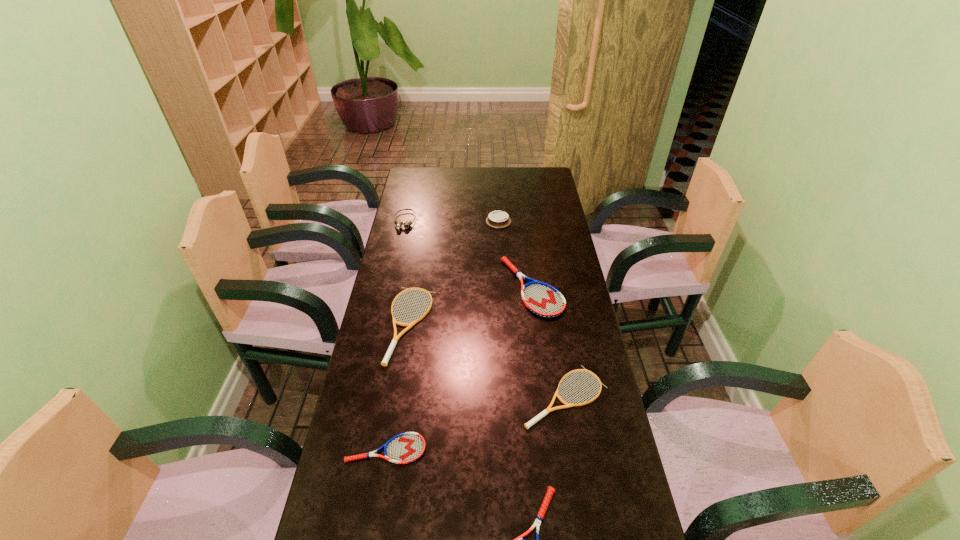
Find the location of a particular element. This screenshot has height=540, width=960. vacant region between the shortest object and the biggest blue tennis racket is located at coordinates (459, 368).

The image size is (960, 540). In order to click on unoccupied position between the shortest tennis racket and the biggest blue tennis racket in this screenshot , I will do `click(459, 368)`.

The height and width of the screenshot is (540, 960). In order to click on vacant space that is in between the right beige tennis racket and the goggles in this screenshot , I will do `click(485, 309)`.

You are a GUI agent. You are given a task and a screenshot of the screen. Output one action in this format:
    pyautogui.click(x=<x>, y=<y>)
    Task: Click on the object that is the second closest to the fourth farthest tennis racket
    The height and width of the screenshot is (540, 960).
    Given the screenshot: What is the action you would take?
    pyautogui.click(x=395, y=339)

Find the location of a particular element. The width and height of the screenshot is (960, 540). object identified as the closest to the bigger beige tennis racket is located at coordinates (407, 447).

You are a GUI agent. You are given a task and a screenshot of the screen. Output one action in this format:
    pyautogui.click(x=<x>, y=<y>)
    Task: Click on the tennis racket that can be found as the second closest to the shortest tennis racket
    The height and width of the screenshot is (540, 960).
    Given the screenshot: What is the action you would take?
    pyautogui.click(x=395, y=339)

Select which tennis racket appears as the third closest to the left beige tennis racket. Please provide its 2D coordinates. Your answer should be formatted as a tuple, i.e. [(x, y)], where the tuple contains the x and y coordinates of a point satisfying the conditions above.

[(527, 425)]

Locate which blue tennis racket ranks second in proximity to the nearest tennis racket. Please provide its 2D coordinates. Your answer should be formatted as a tuple, i.e. [(x, y)], where the tuple contains the x and y coordinates of a point satisfying the conditions above.

[(542, 299)]

Choose which blue tennis racket is the nearest neighbor to the smaller beige tennis racket. Please provide its 2D coordinates. Your answer should be formatted as a tuple, i.e. [(x, y)], where the tuple contains the x and y coordinates of a point satisfying the conditions above.

[(550, 490)]

In order to click on beige tennis racket identified as the closest to the chocolate cake in this screenshot , I will do `click(395, 339)`.